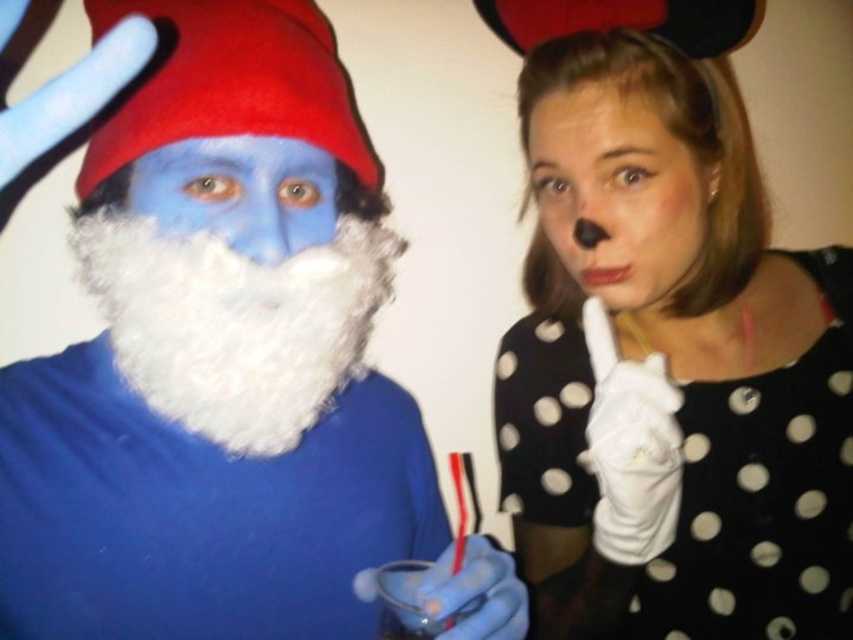
Question: Which point is closer to the camera?

Choices:
 (A) (282, 380)
 (B) (247, 432)

Answer: (A)

Question: Which object is farther from the camera taking this photo?

Choices:
 (A) white polka dot dress at center
 (B) white fluffy beard at center
 (C) blue matte face at left

Answer: (A)

Question: Among these points, which one is nearest to the camera?

Choices:
 (A) (315, 300)
 (B) (650, 60)
 (C) (171, 164)
 (D) (585, 163)

Answer: (A)

Question: Can you confirm if matte black nose at center is positioned above blue matte face at left?

Choices:
 (A) no
 (B) yes

Answer: (B)

Question: Does white polka dot dress at center appear on the left side of white fluffy beard at left?

Choices:
 (A) no
 (B) yes

Answer: (A)

Question: Does white polka dot dress at center lie in front of blue matte face at left?

Choices:
 (A) yes
 (B) no

Answer: (B)